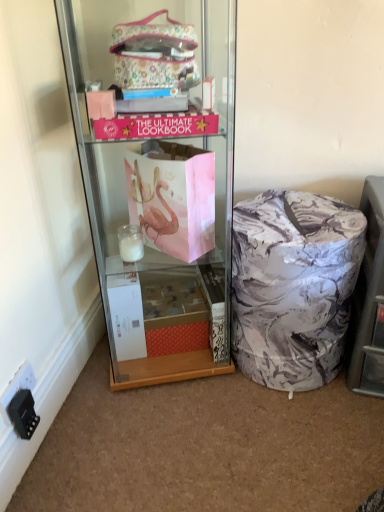
Identify the location of free space in front of matte pink paper bag at center. This screenshot has width=384, height=512. (176, 441).